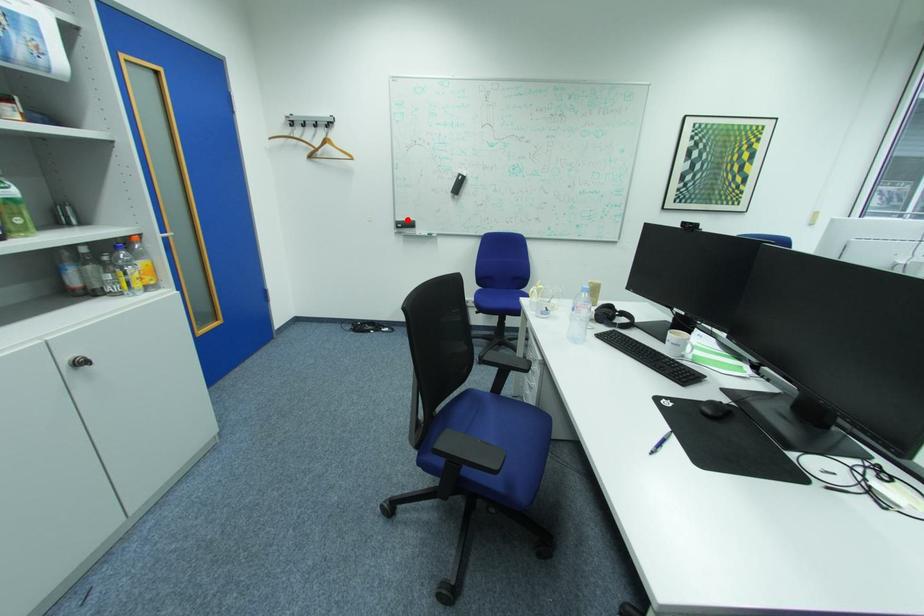
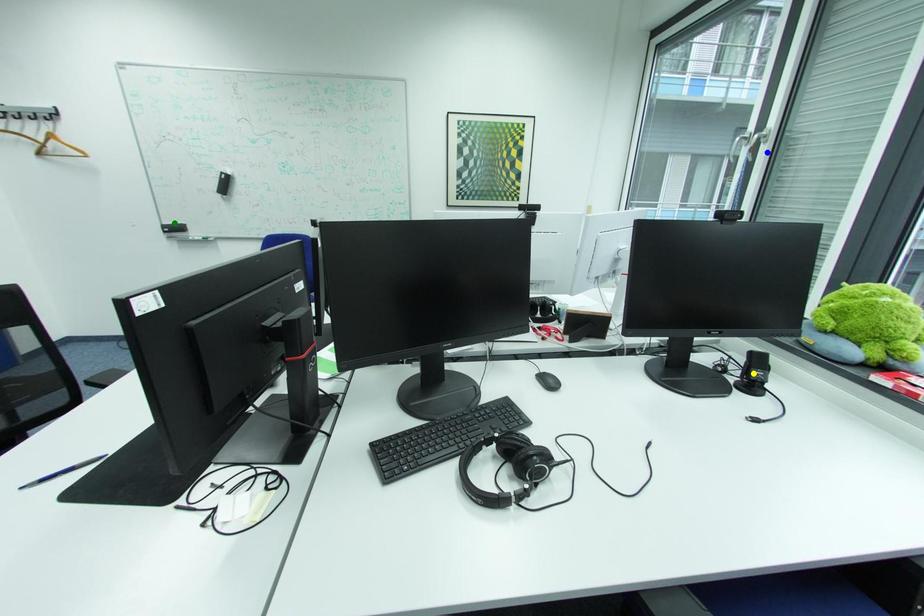
Question: I am providing you with two images of the same scene from different viewpoints. A red point is marked on the first image. You are given multiple points on the second image. In image 2, which mark is for the same physical point as the one in image 1?

Choices:
 (A) blue point
 (B) yellow point
 (C) green point

Answer: (C)